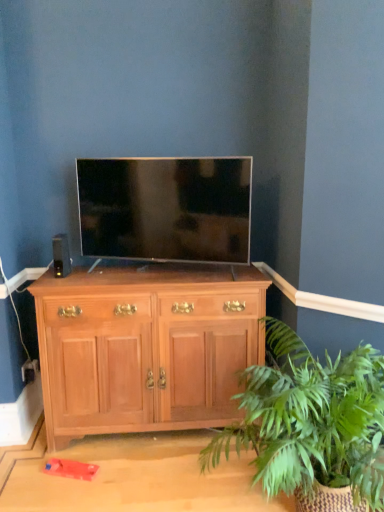
Question: Considering the positions of green leafy plant at lower right and black matte speaker at left in the image, is green leafy plant at lower right taller or shorter than black matte speaker at left?

Choices:
 (A) short
 (B) tall

Answer: (B)

Question: Does point (281, 339) appear closer or farther from the camera than point (57, 242)?

Choices:
 (A) farther
 (B) closer

Answer: (B)

Question: Which is nearer to the light brown wood cabinet at center?

Choices:
 (A) matte black tv at center
 (B) black matte speaker at left
 (C) green leafy plant at lower right

Answer: (A)

Question: Which object is the closest to the green leafy plant at lower right?

Choices:
 (A) matte black tv at center
 (B) black matte speaker at left
 (C) light brown wood cabinet at center

Answer: (C)